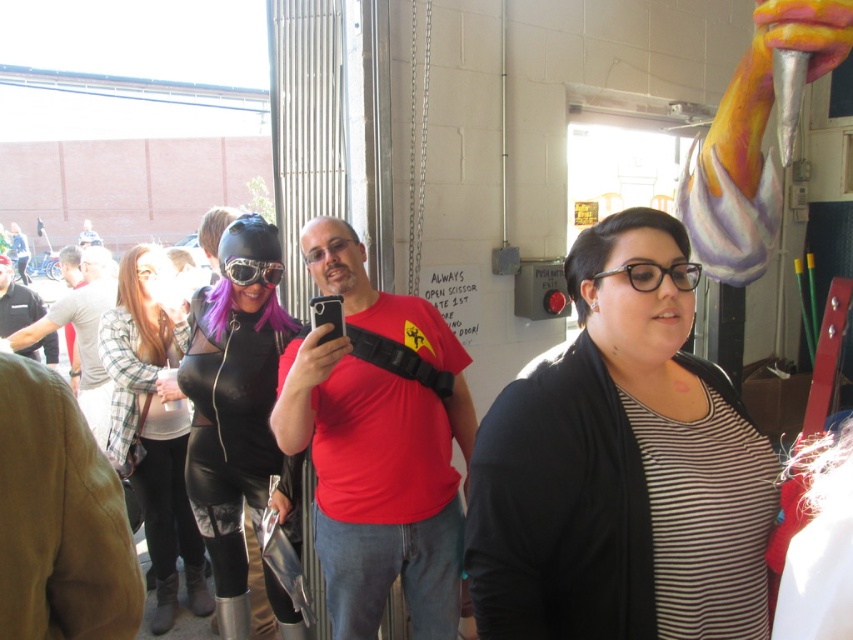
Which is below, black leather bodysuit at center or metallic silver goggles at center?

Positioned lower is black leather bodysuit at center.

Does point (218, 586) lie behind point (260, 275)?

Yes, it is.

Is point (262, 339) in front of point (254, 280)?

No, (262, 339) is behind (254, 280).

You are a GUI agent. You are given a task and a screenshot of the screen. Output one action in this format:
    pyautogui.click(x=<x>, y=<y>)
    Task: Click on the black leather bodysuit at center
    
    Given the screenshot: What is the action you would take?
    pyautogui.click(x=235, y=410)

Which of these two, matte black shirt at center or metallic silver goggles at center, stands shorter?

metallic silver goggles at center

Which is more to the right, matte black shirt at center or metallic silver goggles at center?

metallic silver goggles at center is more to the right.

Between point (10, 298) and point (248, 275), which one is positioned in front?

Positioned in front is point (248, 275).

Image resolution: width=853 pixels, height=640 pixels. Identify the location of matte black shirt at center. (15, 301).

Between striped cotton shirt at center and metallic silver goggles at center, which one has more height?

striped cotton shirt at center

From the picture: Is striped cotton shirt at center taller than metallic silver goggles at center?

Indeed, striped cotton shirt at center has a greater height compared to metallic silver goggles at center.

From the picture: Who is more forward, (x=577, y=342) or (x=244, y=264)?

Point (x=577, y=342) is in front.

This screenshot has width=853, height=640. In order to click on striped cotton shirt at center in this screenshot , I will do `click(619, 468)`.